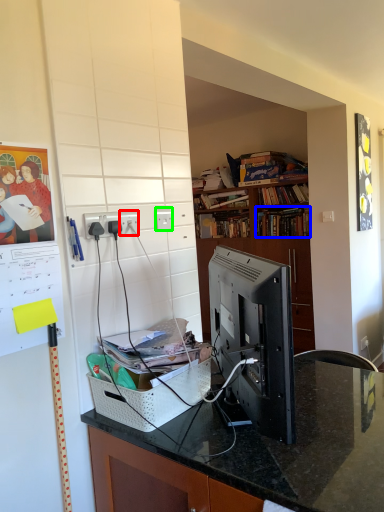
Question: Considering the real-world distances, which object is farthest from electric outlet (highlighted by a red box)? book (highlighted by a blue box) or electric outlet (highlighted by a green box)?

Choices:
 (A) book
 (B) electric outlet

Answer: (A)